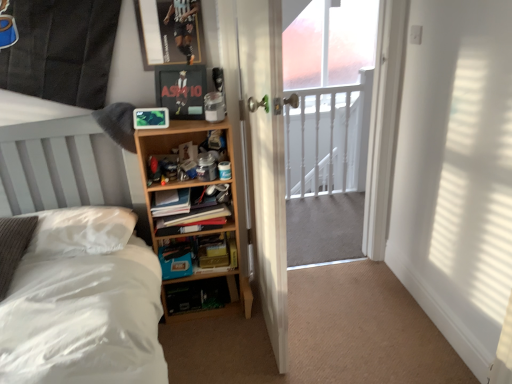
In order to face metallic silver picture frame at upper center, the first picture frame viewed from the top, should I rotate leftwards or rightwards?

Rotate your view left by about 11.326°.

This screenshot has height=384, width=512. Find the location of `metallic silver picture frame at upper center, the first picture frame viewed from the top`. metallic silver picture frame at upper center, the first picture frame viewed from the top is located at coordinates (170, 32).

The width and height of the screenshot is (512, 384). Describe the element at coordinates (84, 311) in the screenshot. I see `white soft bed at left` at that location.

Find the location of a particular element. The height and width of the screenshot is (384, 512). clear glass screen door at center is located at coordinates (329, 116).

The image size is (512, 384). What do you see at coordinates (326, 166) in the screenshot?
I see `white glossy railings at center` at bounding box center [326, 166].

This screenshot has width=512, height=384. What do you see at coordinates (266, 159) in the screenshot?
I see `white wooden door at center` at bounding box center [266, 159].

What do you see at coordinates (181, 90) in the screenshot? The width and height of the screenshot is (512, 384). I see `matte black picture frame at upper center, which is counted as the first picture frame, starting from the bottom` at bounding box center [181, 90].

Where is `wooden bookshelf at center`? wooden bookshelf at center is located at coordinates (193, 219).

Identify the location of metallic silver picture frame at upper center, the first picture frame viewed from the top. Image resolution: width=512 pixels, height=384 pixels. (170, 32).

Is metallic silver picture frame at upper center, the first picture frame viewed from the top, wider or thinner than white soft bed at left?

Considering their sizes, metallic silver picture frame at upper center, the first picture frame viewed from the top, looks slimmer than white soft bed at left.

Considering the sizes of objects metallic silver picture frame at upper center, which ranks as the second picture frame in bottom-to-top order, and white soft bed at left in the image provided, who is smaller, metallic silver picture frame at upper center, which ranks as the second picture frame in bottom-to-top order, or white soft bed at left?

metallic silver picture frame at upper center, which ranks as the second picture frame in bottom-to-top order, is smaller.

Identify the location of bed below the metallic silver picture frame at upper center, which ranks as the second picture frame in bottom-to-top order (from the image's perspective). (84, 311).

Looking at this image, is metallic silver picture frame at upper center, which ranks as the second picture frame in bottom-to-top order, positioned behind white soft bed at left?

Yes, it is.

Would you say clear glass screen door at center is outside hardcover book at center?

Indeed, clear glass screen door at center is completely outside hardcover book at center.

Considering the sizes of clear glass screen door at center and hardcover book at center in the image, is clear glass screen door at center wider or thinner than hardcover book at center?

In the image, clear glass screen door at center appears to be wider than hardcover book at center.

From the image's perspective, which object appears higher, clear glass screen door at center or hardcover book at center?

clear glass screen door at center, from the image's perspective.

Is wooden shelf at center far away from clear glass screen door at center?

Indeed, wooden shelf at center is not near clear glass screen door at center.

Does wooden shelf at center have a lesser height compared to clear glass screen door at center?

Yes, wooden shelf at center is shorter than clear glass screen door at center.

Considering the relative sizes of wooden shelf at center and clear glass screen door at center in the image provided, is wooden shelf at center thinner than clear glass screen door at center?

Incorrect, the width of wooden shelf at center is not less than that of clear glass screen door at center.

Can you confirm if wooden shelf at center is bigger than clear glass screen door at center?

Correct, wooden shelf at center is larger in size than clear glass screen door at center.

From the image's perspective, is white glossy railings at center located above clear glass screen door at center?

No, from the image's perspective, white glossy railings at center is not over clear glass screen door at center.

Can you confirm if white glossy railings at center is positioned to the right of clear glass screen door at center?

Indeed, white glossy railings at center is positioned on the right side of clear glass screen door at center.

Is white glossy railings at center oriented away from clear glass screen door at center?

white glossy railings at center is not turned away from clear glass screen door at center.

Where is `screen door located in front of the white glossy railings at center`? Image resolution: width=512 pixels, height=384 pixels. screen door located in front of the white glossy railings at center is located at coordinates (329, 116).

Is white wooden door at center bigger than wooden shelf at center?

Correct, white wooden door at center is larger in size than wooden shelf at center.

From their relative heights in the image, would you say white wooden door at center is taller or shorter than wooden shelf at center?

white wooden door at center is taller than wooden shelf at center.

Would you consider white wooden door at center to be distant from wooden shelf at center?

No, white wooden door at center is not far from wooden shelf at center.

Is wooden shelf at center a part of white wooden door at center?

No, wooden shelf at center is not inside white wooden door at center.

Who is taller, metallic silver picture frame at upper center, the first picture frame viewed from the top, or hardcover book at center?

metallic silver picture frame at upper center, the first picture frame viewed from the top.

Could you tell me if metallic silver picture frame at upper center, which ranks as the second picture frame in bottom-to-top order, is turned towards hardcover book at center?

No, metallic silver picture frame at upper center, which ranks as the second picture frame in bottom-to-top order, does not turn towards hardcover book at center.

This screenshot has width=512, height=384. Identify the location of paperback book below the metallic silver picture frame at upper center, the first picture frame viewed from the top (from a real-world perspective). (217, 251).

Would you say hardcover book at center is part of metallic silver picture frame at upper center, the first picture frame viewed from the top,'s contents?

That's incorrect, hardcover book at center is not inside metallic silver picture frame at upper center, the first picture frame viewed from the top.

Is wooden bookshelf at center oriented away from matte black picture frame at upper center, which is counted as the first picture frame, starting from the bottom?

No, wooden bookshelf at center is not facing the opposite direction of matte black picture frame at upper center, which is counted as the first picture frame, starting from the bottom.

Which object is closer to the camera taking this photo, wooden bookshelf at center or matte black picture frame at upper center, the 2th picture frame positioned from the top?

matte black picture frame at upper center, the 2th picture frame positioned from the top.

Considering the sizes of objects wooden bookshelf at center and matte black picture frame at upper center, which is counted as the first picture frame, starting from the bottom, in the image provided, who is taller, wooden bookshelf at center or matte black picture frame at upper center, which is counted as the first picture frame, starting from the bottom,?

Standing taller between the two is matte black picture frame at upper center, which is counted as the first picture frame, starting from the bottom.

From the picture: From the image's perspective, is wooden bookshelf at center on top of matte black picture frame at upper center, the 2th picture frame positioned from the top?

Actually, wooden bookshelf at center appears below matte black picture frame at upper center, the 2th picture frame positioned from the top, in the image.

Starting from the white soft bed at left, which picture frame is the 1st one behind? Please provide its 2D coordinates.

[(170, 32)]

Find the location of a particular element. screen door lying in front of the hardcover book at center is located at coordinates (329, 116).

Estimate the real-world distances between objects in this image. Which object is further from white soft bed at left, clear glass screen door at center or matte black picture frame at upper center, the 2th picture frame positioned from the top?

Based on the image, clear glass screen door at center appears to be further to white soft bed at left.

Based on their spatial positions, is wooden shelf at center or hardcover book at center further from wooden bookshelf at center?

Among the two, wooden shelf at center is located further to wooden bookshelf at center.

From the image, which object appears to be farther from wooden shelf at center, hardcover book at center or wooden bookshelf at center?

hardcover book at center is positioned further to the anchor wooden shelf at center.

Estimate the real-world distances between objects in this image. Which object is further from wooden shelf at center, white wooden door at center or white glossy railings at center?

The object further to wooden shelf at center is white glossy railings at center.

From the image, which object appears to be farther from white glossy railings at center, clear glass screen door at center or wooden bookshelf at center?

Based on the image, wooden bookshelf at center appears to be further to white glossy railings at center.

When comparing their distances from white glossy railings at center, does wooden shelf at center or wooden bookshelf at center seem further?

The object further to white glossy railings at center is wooden bookshelf at center.

Estimate the real-world distances between objects in this image. Which object is closer to hardcover book at center, matte black picture frame at upper center, which is counted as the first picture frame, starting from the bottom, or metallic silver picture frame at upper center, the first picture frame viewed from the top?

matte black picture frame at upper center, which is counted as the first picture frame, starting from the bottom, is closer to hardcover book at center.

Estimate the real-world distances between objects in this image. Which object is closer to wooden bookshelf at center, wooden shelf at center or white glossy railings at center?

Based on the image, wooden shelf at center appears to be nearer to wooden bookshelf at center.

Find the location of `book between white wooden door at center and clear glass screen door at center from front to back`. book between white wooden door at center and clear glass screen door at center from front to back is located at coordinates (193, 219).

Where is `door between metallic silver picture frame at upper center, which ranks as the second picture frame in bottom-to-top order, and wooden bookshelf at center in the up-down direction`? door between metallic silver picture frame at upper center, which ranks as the second picture frame in bottom-to-top order, and wooden bookshelf at center in the up-down direction is located at coordinates (266, 159).

Image resolution: width=512 pixels, height=384 pixels. I want to click on door located between white soft bed at left and metallic silver picture frame at upper center, the first picture frame viewed from the top, in the depth direction, so click(266, 159).

You are a GUI agent. You are given a task and a screenshot of the screen. Output one action in this format:
    pyautogui.click(x=<x>, y=<y>)
    Task: Click on the picture frame that lies between metallic silver picture frame at upper center, which ranks as the second picture frame in bottom-to-top order, and white wooden door at center from top to bottom
    This screenshot has width=512, height=384.
    Given the screenshot: What is the action you would take?
    pyautogui.click(x=181, y=90)